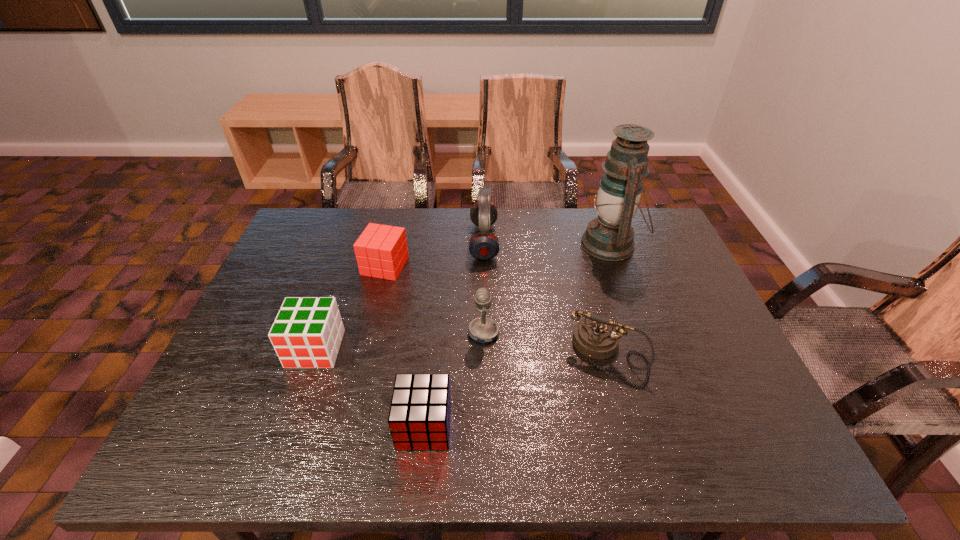
Find the location of a particular element. earphone that is at the far edge is located at coordinates (483, 245).

The height and width of the screenshot is (540, 960). In order to click on cube at the far edge in this screenshot , I will do `click(381, 251)`.

The image size is (960, 540). Find the location of `object present at the near edge`. object present at the near edge is located at coordinates (419, 418).

What are the coordinates of `object that is at the left edge` in the screenshot? It's located at (307, 332).

Where is `object present at the right edge`? This screenshot has height=540, width=960. object present at the right edge is located at coordinates (609, 237).

Where is `object that is at the far right corner`? The height and width of the screenshot is (540, 960). object that is at the far right corner is located at coordinates (609, 237).

The image size is (960, 540). Find the location of `free space at the far edge of the desktop`. free space at the far edge of the desktop is located at coordinates (512, 231).

Locate an element on the screen. vacant area at the near edge of the desktop is located at coordinates (583, 447).

Find the location of `blank space at the right edge`. blank space at the right edge is located at coordinates (709, 319).

In the image, there is a desktop. Identify the location of free space at the far left corner. (304, 211).